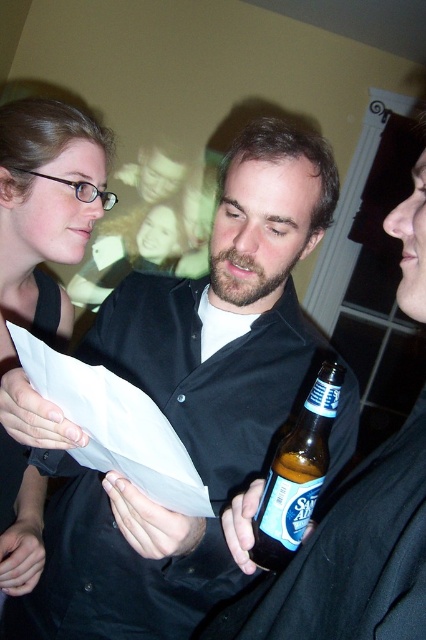
Can you confirm if matte black shirt at center is wider than white paper at center?

Yes, matte black shirt at center is wider than white paper at center.

Between point (290, 236) and point (196, 483), which one is positioned behind?

Point (290, 236)

This screenshot has height=640, width=426. In order to click on matte black shirt at center in this screenshot , I will do `click(230, 312)`.

Locate an element on the screen. Image resolution: width=426 pixels, height=640 pixels. matte black hair at upper left is located at coordinates (46, 211).

Find the location of a particular element. The image size is (426, 640). matte black hair at upper left is located at coordinates (46, 211).

Is matte black hair at upper left smaller than white paper at center?

Actually, matte black hair at upper left might be larger than white paper at center.

I want to click on matte black hair at upper left, so click(46, 211).